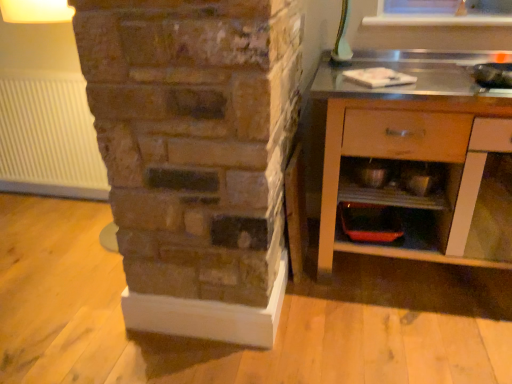
Question: From the image's perspective, relative to white ribbed radiator at left, is matte orange tray at lower center, the 1th shelf ordered from the bottom, above or below?

Choices:
 (A) below
 (B) above

Answer: (A)

Question: Looking at the image, does matte orange tray at lower center, the 1th shelf ordered from the bottom, seem bigger or smaller compared to white ribbed radiator at left?

Choices:
 (A) big
 (B) small

Answer: (B)

Question: Which of these objects is positioned closest to the metallic silver bowls at lower right, placed as the 1th shelf when sorted from top to bottom?

Choices:
 (A) white ribbed radiator at left
 (B) matte orange tray at lower center, the 1th shelf ordered from the bottom
 (C) wooden cabinet at right

Answer: (C)

Question: Which object is positioned farthest from the wooden cabinet at right?

Choices:
 (A) matte orange tray at lower center, the 2th shelf positioned from the top
 (B) metallic silver bowls at lower right, placed as the 1th shelf when sorted from top to bottom
 (C) white ribbed radiator at left

Answer: (C)